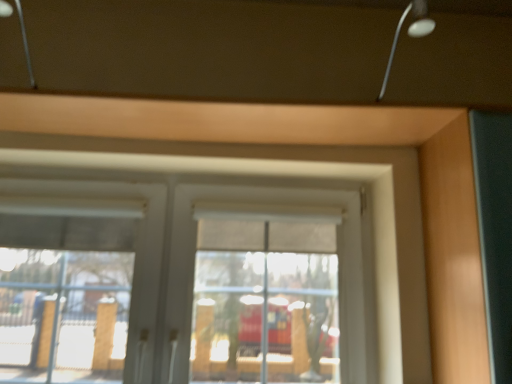
Question: Is metallic silver lamp at upper right, which is the 2th lamp from left to right, not within metallic silver lamp at upper left, which appears as the 1th lamp when viewed from the left?

Choices:
 (A) yes
 (B) no

Answer: (A)

Question: Can you confirm if metallic silver lamp at upper right, which is the 2th lamp from left to right, is positioned to the right of metallic silver lamp at upper left, which appears as the 1th lamp when viewed from the left?

Choices:
 (A) yes
 (B) no

Answer: (A)

Question: Is metallic silver lamp at upper right, the 1th lamp in the right-to-left sequence, positioned far away from metallic silver lamp at upper left, which appears as the 1th lamp when viewed from the left?

Choices:
 (A) yes
 (B) no

Answer: (A)

Question: Is metallic silver lamp at upper left, the 2th lamp positioned from the right, inside metallic silver lamp at upper right, the 1th lamp in the right-to-left sequence?

Choices:
 (A) no
 (B) yes

Answer: (A)

Question: Does metallic silver lamp at upper right, the 1th lamp in the right-to-left sequence, have a greater width compared to metallic silver lamp at upper left, which appears as the 1th lamp when viewed from the left?

Choices:
 (A) no
 (B) yes

Answer: (A)

Question: Does metallic silver lamp at upper right, which is the 2th lamp from left to right, appear on the left side of metallic silver lamp at upper left, which appears as the 1th lamp when viewed from the left?

Choices:
 (A) no
 (B) yes

Answer: (A)

Question: Is the position of matte wood garage door at right less distant than that of metallic silver lamp at upper left, which appears as the 1th lamp when viewed from the left?

Choices:
 (A) no
 (B) yes

Answer: (A)

Question: Can you confirm if matte wood garage door at right is taller than metallic silver lamp at upper left, the 2th lamp positioned from the right?

Choices:
 (A) no
 (B) yes

Answer: (B)

Question: From the image's perspective, is matte wood garage door at right below metallic silver lamp at upper left, the 2th lamp positioned from the right?

Choices:
 (A) no
 (B) yes

Answer: (B)

Question: Can you confirm if matte wood garage door at right is bigger than metallic silver lamp at upper left, which appears as the 1th lamp when viewed from the left?

Choices:
 (A) no
 (B) yes

Answer: (B)

Question: Is matte wood garage door at right aimed at metallic silver lamp at upper left, the 2th lamp positioned from the right?

Choices:
 (A) no
 (B) yes

Answer: (A)

Question: Is matte wood garage door at right positioned beyond the bounds of metallic silver lamp at upper left, the 2th lamp positioned from the right?

Choices:
 (A) yes
 (B) no

Answer: (A)

Question: From a real-world perspective, is matte wood garage door at right positioned over white matte window at center based on gravity?

Choices:
 (A) no
 (B) yes

Answer: (B)